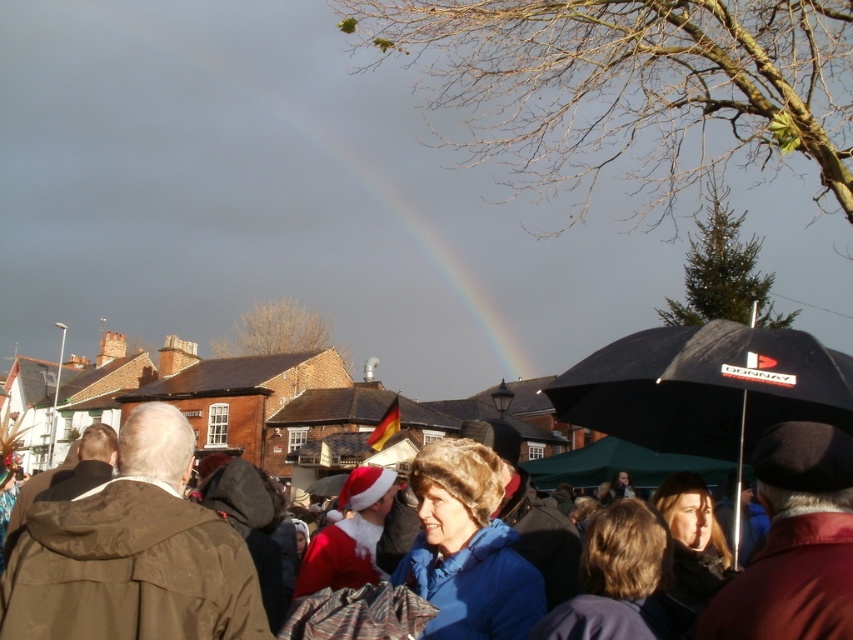
Question: Is blue woolen jacket at center below matte black umbrella at right?

Choices:
 (A) yes
 (B) no

Answer: (A)

Question: Which object appears farthest from the camera in this image?

Choices:
 (A) blue woolen jacket at center
 (B) matte black umbrella at right

Answer: (B)

Question: From the image, what is the correct spatial relationship of blue woolen jacket at center in relation to matte black umbrella at right?

Choices:
 (A) above
 (B) below

Answer: (B)

Question: Which point is farther from the camera taking this photo?

Choices:
 (A) (142, 586)
 (B) (704, 448)

Answer: (B)

Question: Is blue woolen jacket at center bigger than matte black umbrella at right?

Choices:
 (A) no
 (B) yes

Answer: (A)